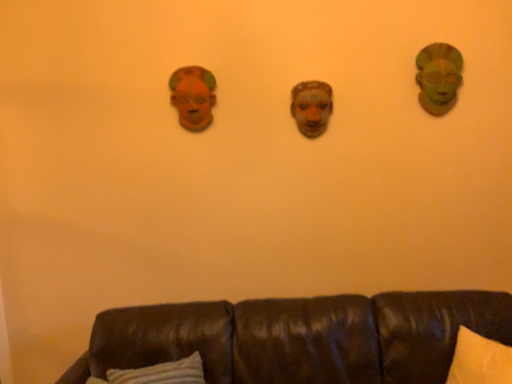
Question: From the image's perspective, is matte orange mask at upper left positioned above or below matte clay mask at center?

Choices:
 (A) above
 (B) below

Answer: (A)

Question: Is matte orange mask at upper left bigger or smaller than matte clay mask at center?

Choices:
 (A) big
 (B) small

Answer: (A)

Question: Which of these objects is positioned farthest from the green matte mask at upper right?

Choices:
 (A) matte orange mask at upper left
 (B) matte clay mask at center
 (C) brown leather couch at lower center

Answer: (C)

Question: Estimate the real-world distances between objects in this image. Which object is farther from the green matte mask at upper right?

Choices:
 (A) matte clay mask at center
 (B) brown leather couch at lower center
 (C) matte orange mask at upper left

Answer: (B)